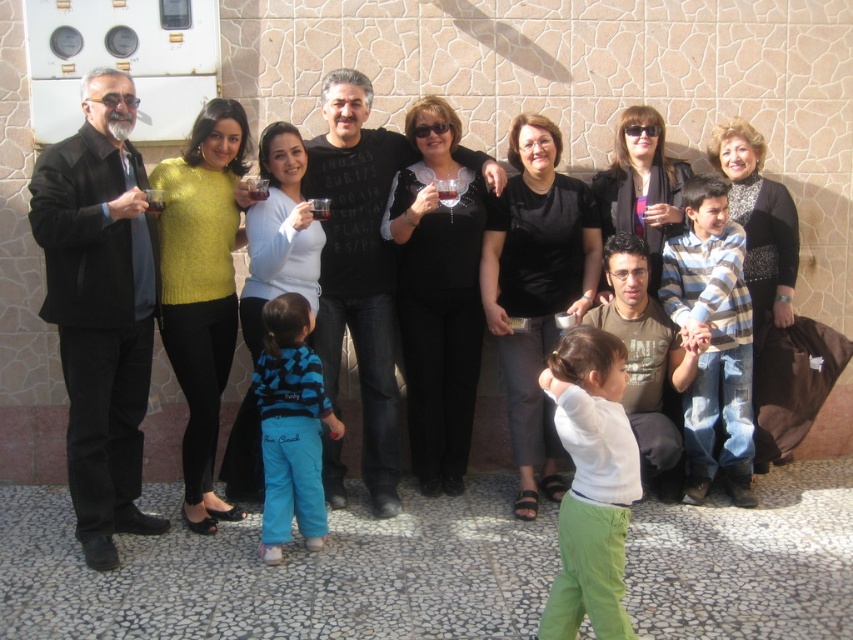
Question: Which point is closer to the camera taking this photo?

Choices:
 (A) (430, 136)
 (B) (775, 292)
 (C) (653, 285)
 (D) (337, 342)

Answer: (D)

Question: Estimate the real-world distances between objects in this image. Which object is farther from the blue fleece pants at lower center?

Choices:
 (A) matte black suit at left
 (B) white cotton shirt at center
 (C) black velvet shirt at center
 (D) striped cotton shirt at right

Answer: (D)

Question: Can you confirm if white cotton shirt at center is bigger than matte black sweater at center?

Choices:
 (A) yes
 (B) no

Answer: (B)

Question: Can you confirm if matte black sweater at center is positioned above black knitwear at upper right?

Choices:
 (A) yes
 (B) no

Answer: (A)

Question: Based on their relative distances, which object is nearer to the black leather jacket at upper center?

Choices:
 (A) black matte pants at center
 (B) white cotton shirt at center

Answer: (A)

Question: In this image, where is matte black suit at left located relative to striped cotton shirt at right?

Choices:
 (A) left
 (B) right

Answer: (A)